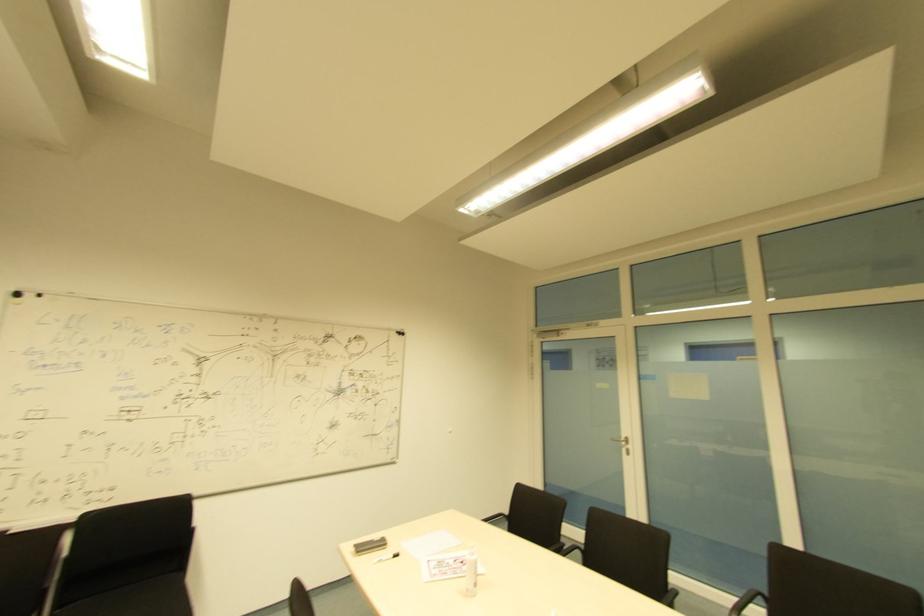
Which object does [447,564] point to?

It corresponds to the white paper box in the image.